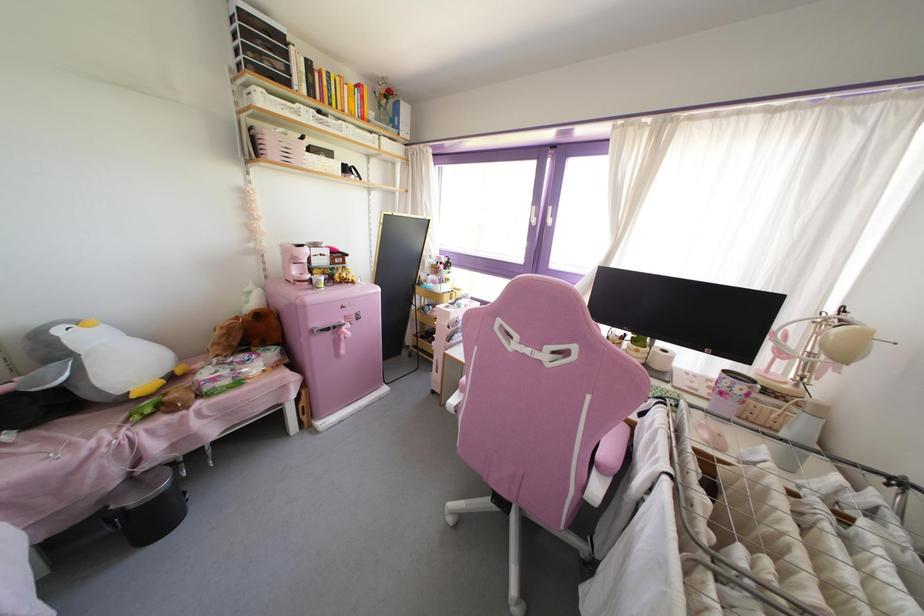
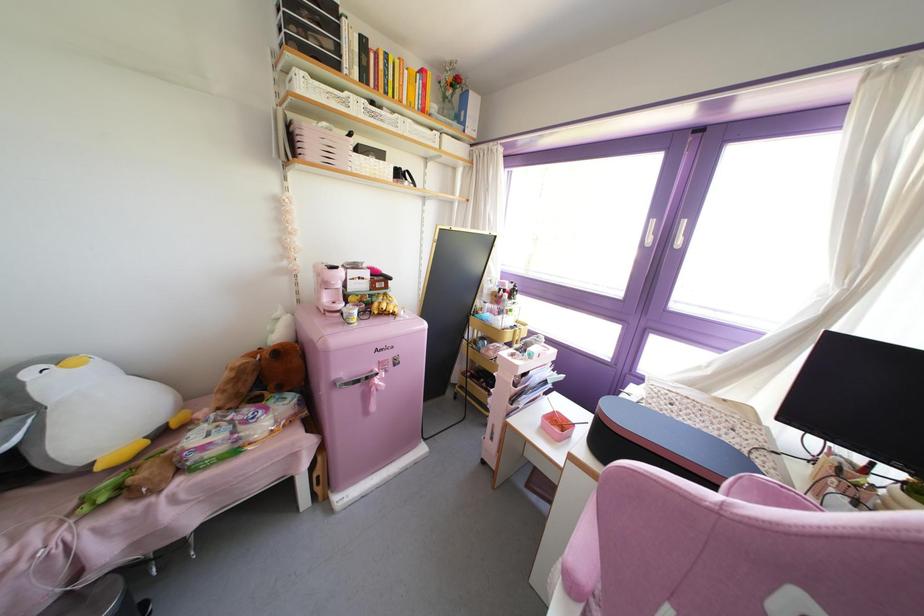
In the second image, find the point that corresponds to point (134, 395) in the first image.

(99, 467)